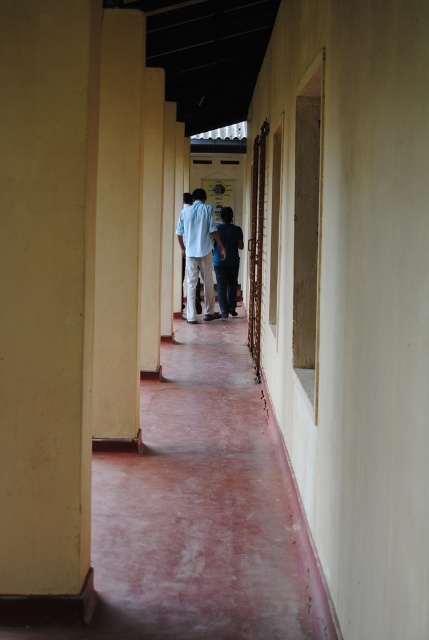
Can you confirm if yellow matte pillar at left is positioned to the left of light blue cotton shirt at center?

Yes, yellow matte pillar at left is to the left of light blue cotton shirt at center.

Between yellow matte pillar at left and light blue cotton shirt at center, which one appears on the right side from the viewer's perspective?

light blue cotton shirt at center is more to the right.

Which is behind, point (81, 44) or point (201, 250)?

Positioned behind is point (201, 250).

I want to click on yellow matte pillar at left, so click(47, 300).

Who is lower down, yellow matte pillar at center or dark blue shirt at center?

yellow matte pillar at center is lower down.

Is point (103, 289) more distant than point (215, 260)?

No.

You are a GUI agent. You are given a task and a screenshot of the screen. Output one action in this format:
    pyautogui.click(x=<x>, y=<y>)
    Task: Click on the yellow matte pillar at center
    The image size is (429, 640).
    Given the screenshot: What is the action you would take?
    pyautogui.click(x=117, y=230)

Which is in front, point (189, 259) or point (218, 285)?

Point (189, 259) is in front.

Which is above, light blue shirt at center or dark blue shirt at center?

light blue shirt at center is above.

Between point (193, 195) and point (226, 221), which one is positioned in front?

Point (193, 195)

The width and height of the screenshot is (429, 640). What are the coordinates of `light blue shirt at center` in the screenshot? It's located at (199, 252).